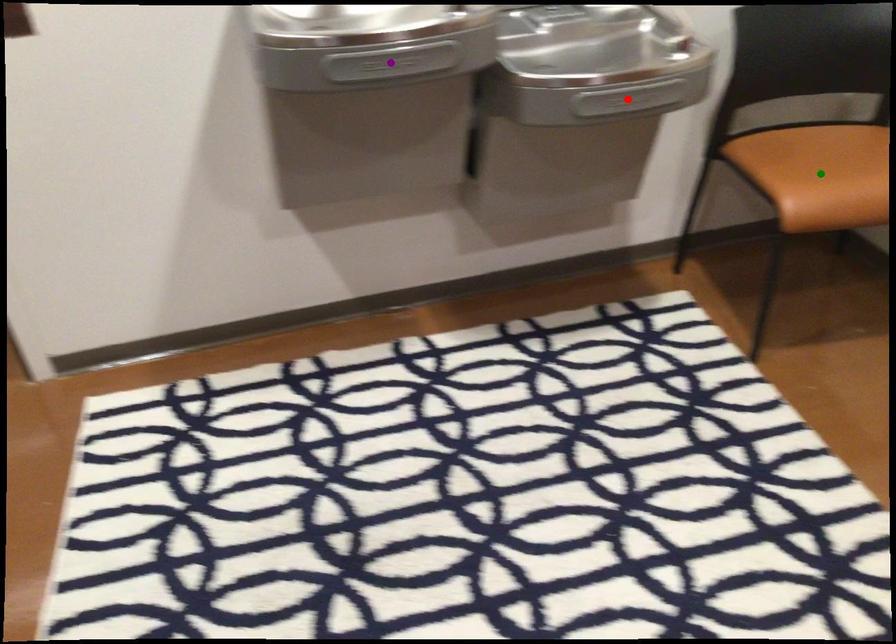
Order these from nearest to farthest:
1. green point
2. red point
3. purple point

purple point, red point, green point